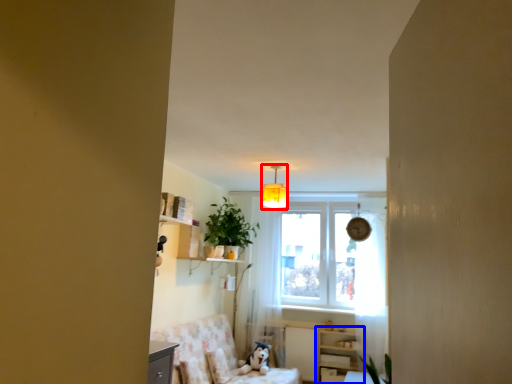
Question: Which of the following is the closest to the observer, light fixture (highlighted by a red box) or dresser (highlighted by a blue box)?

Choices:
 (A) light fixture
 (B) dresser

Answer: (A)